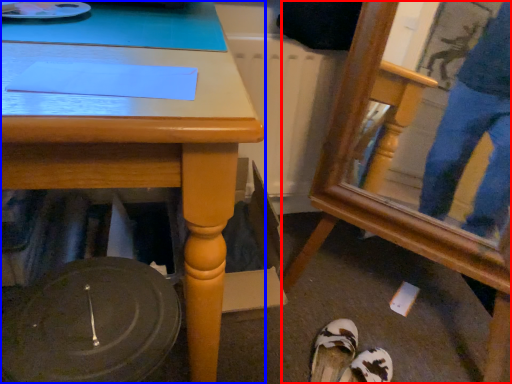
Question: Which of the following is the farthest to the observer, swivel chair (highlighted by a red box) or desk (highlighted by a blue box)?

Choices:
 (A) swivel chair
 (B) desk

Answer: (A)